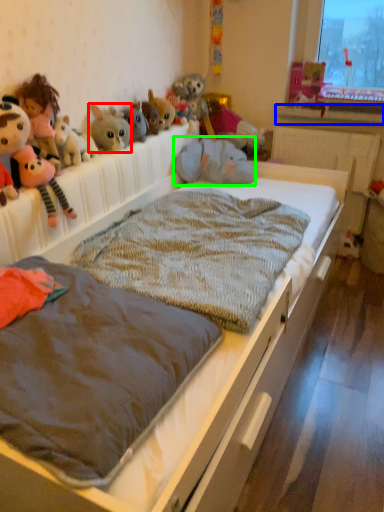
Question: Which is nearer to the toy (highlighted by a red box)? window sill (highlighted by a blue box) or animal (highlighted by a green box).

Choices:
 (A) window sill
 (B) animal

Answer: (B)